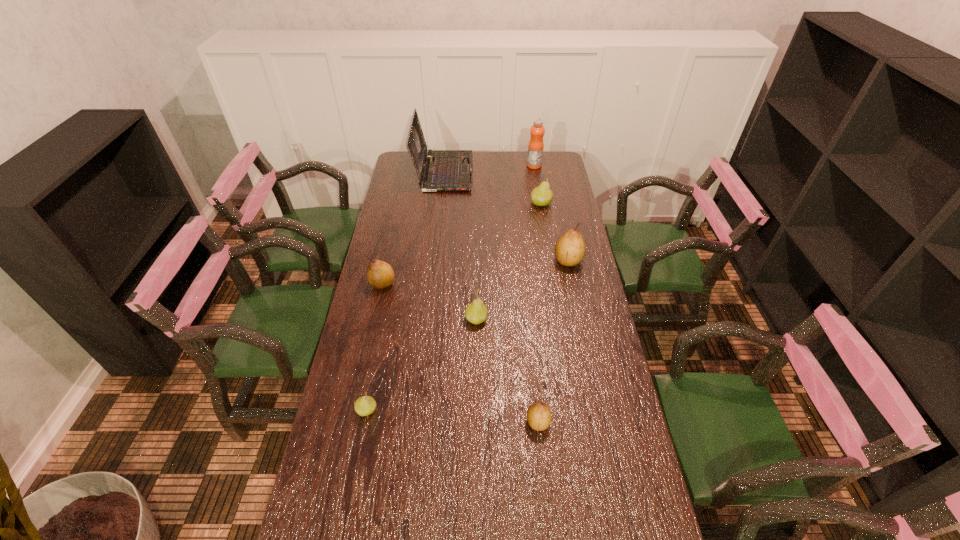
The width and height of the screenshot is (960, 540). In the image, there is a desktop. Identify the location of free space at the right edge. point(551,214).

The height and width of the screenshot is (540, 960). What are the coordinates of `blank region between the laptop computer and the fruit juice` in the screenshot? It's located at (489, 168).

Where is `vacant area that lies between the farthest pear and the fruit juice`? The width and height of the screenshot is (960, 540). vacant area that lies between the farthest pear and the fruit juice is located at coordinates (538, 185).

The width and height of the screenshot is (960, 540). What are the coordinates of `free spot between the fourth pear from left to right and the fourth farthest pear` in the screenshot? It's located at (507, 370).

You are a GUI agent. You are given a task and a screenshot of the screen. Output one action in this format:
    pyautogui.click(x=<x>, y=<y>)
    Task: Click on the vacant point located between the leftmost green pear and the second farthest pear
    Image resolution: width=960 pixels, height=540 pixels.
    Given the screenshot: What is the action you would take?
    pyautogui.click(x=468, y=335)

The height and width of the screenshot is (540, 960). Identify the location of vacant area that lies between the fruit juice and the fourth pear from right to left. (505, 242).

This screenshot has width=960, height=540. What are the coordinates of `vacant area that lies between the rightmost brown pear and the fruit juice` in the screenshot? It's located at pos(551,213).

You are a GUI agent. You are given a task and a screenshot of the screen. Output one action in this format:
    pyautogui.click(x=<x>, y=<y>)
    Task: Click on the empty space that is in between the fruit juice and the third farthest pear
    This screenshot has width=960, height=540.
    Given the screenshot: What is the action you would take?
    pyautogui.click(x=458, y=225)

Where is `vacant space that's between the leftmost green pear and the third pear from right to left`? Image resolution: width=960 pixels, height=540 pixels. vacant space that's between the leftmost green pear and the third pear from right to left is located at coordinates (452, 416).

The height and width of the screenshot is (540, 960). Find the location of `unoccupied area between the rightmost green pear and the biggest brown pear`. unoccupied area between the rightmost green pear and the biggest brown pear is located at coordinates (555, 232).